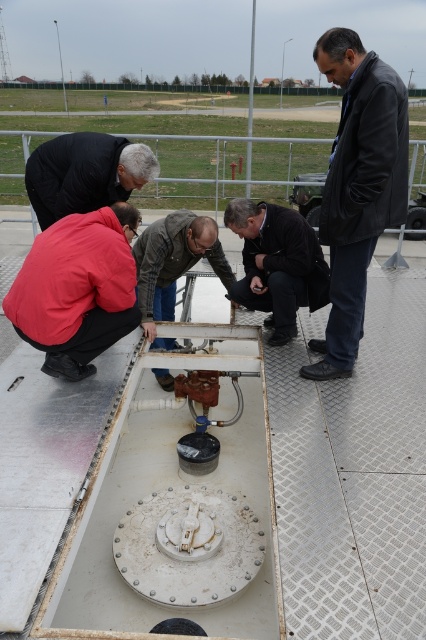
You are a safety inspector at this site and need to ensure social distancing guidelines are followed. The minimum required distance is 3 feet between workers. Are the red matte jacket at lower left and the black matte jacket at center maintaining the required distance?

The red matte jacket at lower left is 31.83 inches away from the black matte jacket at center. Since 3 feet equals 36 inches, the distance between them is less than the required 36 inches. Therefore, they are not maintaining the required social distancing guideline.

You are a safety inspector at the construction site. You need to ensure that all workers are wearing their jackets properly. Looking at the image, where is the red matte jacket at lower left in relation to the black matte jacket at center?

The red matte jacket at lower left is located below the black matte jacket at center.